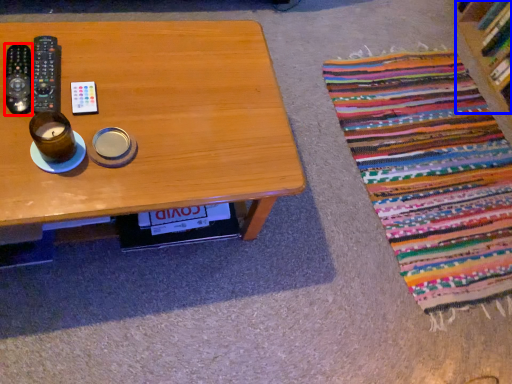
Question: Which object is closer to the camera taking this photo, remote control (highlighted by a red box) or shelf (highlighted by a blue box)?

Choices:
 (A) remote control
 (B) shelf

Answer: (A)